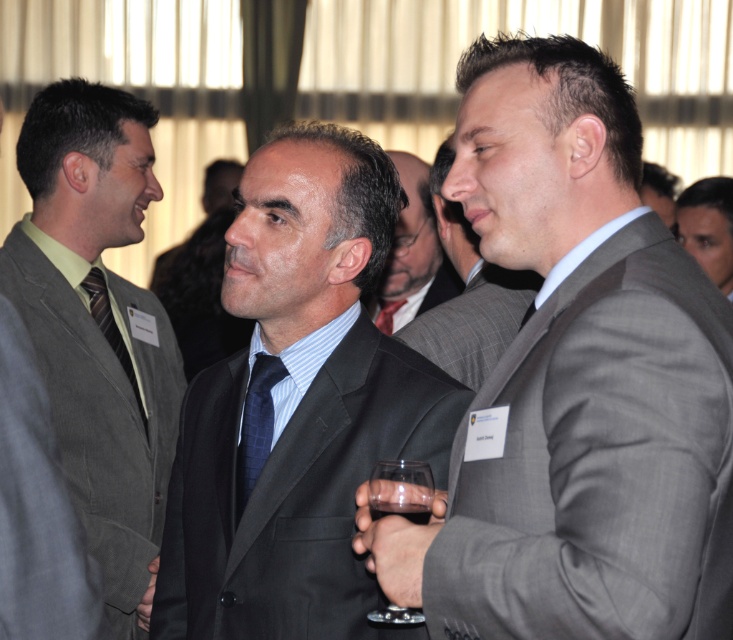
You are organizing a photo shoot and need to position two props. The smooth gray suit at right and the striped fabric tie at center are part of the setup. Given their current positions, can you place a 3.0 meter long banner between them without bending it?

The smooth gray suit at right and striped fabric tie at center are 2.80 meters apart. Since the banner is 3.0 meters long, it is slightly longer than the distance between them. Therefore, the banner cannot be placed straight between them without bending.

You are at a social event and notice a gray suit at right. Can you tell me the location of the point with coordinates [707,227] in relation to the gray suit at right?

The point with coordinates [707,227] is located on the smooth gray suit at right.

You are organizing a charity event and need to seat these two gentlemen in chairs that are exactly 40 cm wide. Based on their suits, can both the gray textured suit at center and the smooth gray suit at right fit comfortably in the chairs?

The gray textured suit at center is wider than the smooth gray suit at right. Since the chairs are only 40 cm wide, the gray textured suit at center may not fit comfortably, but the smooth gray suit at right might fit better.